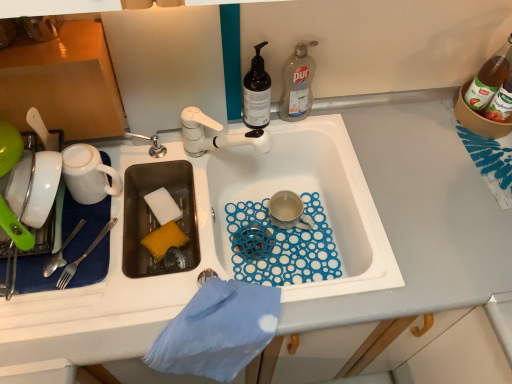
Question: Considering the relative positions of translucent dark brown bottle at upper center, the first bottle when ordered from left to right, and matte ceramic mug at center, the first coffee cup viewed from the right, in the image provided, is translucent dark brown bottle at upper center, the first bottle when ordered from left to right, behind matte ceramic mug at center, the first coffee cup viewed from the right,?

Choices:
 (A) no
 (B) yes

Answer: (A)

Question: Is translucent dark brown bottle at upper center, the third bottle in the right-to-left sequence, positioned before matte ceramic mug at center, positioned as the 2th coffee cup in left-to-right order?

Choices:
 (A) yes
 (B) no

Answer: (A)

Question: Is translucent dark brown bottle at upper center, the first bottle when ordered from left to right, at the left side of matte ceramic mug at center, which ranks as the 2th coffee cup in front-to-back order?

Choices:
 (A) no
 (B) yes

Answer: (B)

Question: Is translucent dark brown bottle at upper center, the first bottle when ordered from left to right, facing towards matte ceramic mug at center, which is the 1th coffee cup in back-to-front order?

Choices:
 (A) yes
 (B) no

Answer: (B)

Question: Does translucent dark brown bottle at upper center, the third bottle in the right-to-left sequence, have a greater height compared to matte ceramic mug at center, positioned as the 2th coffee cup in left-to-right order?

Choices:
 (A) no
 (B) yes

Answer: (B)

Question: Considering the relative positions of shiny silver fork at left and yellow sponge at sink left, the 1th food from the bottom, in the image provided, is shiny silver fork at left to the left or to the right of yellow sponge at sink left, the 1th food from the bottom,?

Choices:
 (A) left
 (B) right

Answer: (A)

Question: Considering the positions of point (56, 253) and point (165, 228), is point (56, 253) closer or farther from the camera than point (165, 228)?

Choices:
 (A) farther
 (B) closer

Answer: (B)

Question: In terms of height, does shiny silver fork at left look taller or shorter compared to yellow sponge at sink left, the 1th food from the bottom?

Choices:
 (A) short
 (B) tall

Answer: (A)

Question: In the image, is shiny silver fork at left positioned in front of or behind yellow sponge at sink left, which is the second food in top-to-bottom order?

Choices:
 (A) behind
 (B) front

Answer: (B)

Question: From the image's perspective, is clear plastic bottle at upper right, positioned as the 2th bottle in left-to-right order, above or below yellow sponge at sink left, the 1th food from the bottom?

Choices:
 (A) above
 (B) below

Answer: (A)

Question: Looking at their shapes, would you say clear plastic bottle at upper right, positioned as the 2th bottle in left-to-right order, is wider or thinner than yellow sponge at sink left, the 1th food from the bottom?

Choices:
 (A) thin
 (B) wide

Answer: (B)

Question: Is clear plastic bottle at upper right, positioned as the 2th bottle in left-to-right order, taller or shorter than yellow sponge at sink left, which is the second food in top-to-bottom order?

Choices:
 (A) tall
 (B) short

Answer: (A)

Question: Is clear plastic bottle at upper right, positioned as the 2th bottle in left-to-right order, to the left or to the right of yellow sponge at sink left, which is the second food in top-to-bottom order, in the image?

Choices:
 (A) left
 (B) right

Answer: (B)

Question: From the image's perspective, is translucent dark brown bottle at upper center, the first bottle when ordered from left to right, located above or below shiny silver fork at left?

Choices:
 (A) above
 (B) below

Answer: (A)

Question: In terms of width, does translucent dark brown bottle at upper center, the first bottle when ordered from left to right, look wider or thinner when compared to shiny silver fork at left?

Choices:
 (A) thin
 (B) wide

Answer: (A)